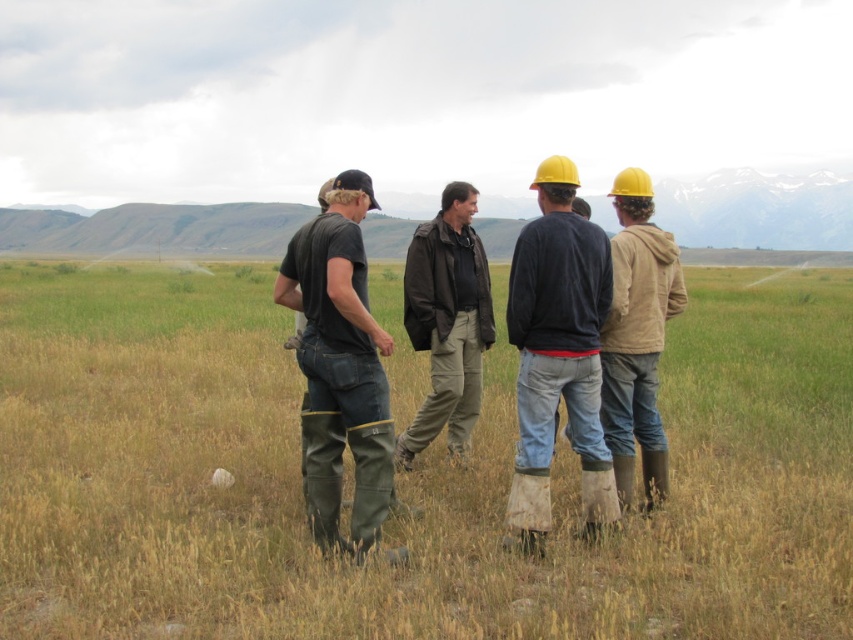
Is point (692, 333) farther from camera compared to point (428, 241)?

Yes, it is.

Between point (196, 435) and point (459, 269), which one is positioned behind?

Point (196, 435)

Locate an element on the screen. The height and width of the screenshot is (640, 853). green grassy at center is located at coordinates (405, 476).

Is the position of tan fabric jacket at right less distant than that of dark brown leather jacket at center?

Yes, tan fabric jacket at right is in front of dark brown leather jacket at center.

Between point (666, 257) and point (469, 346), which one is positioned behind?

The point (469, 346) is behind.

Image resolution: width=853 pixels, height=640 pixels. I want to click on tan fabric jacket at right, so click(x=637, y=337).

Which of these two, dark green rubber boots at center or tan fabric jacket at right, stands taller?

Standing taller between the two is dark green rubber boots at center.

Is dark green rubber boots at center to the right of tan fabric jacket at right from the viewer's perspective?

Incorrect, dark green rubber boots at center is not on the right side of tan fabric jacket at right.

Where is `dark green rubber boots at center`? Image resolution: width=853 pixels, height=640 pixels. dark green rubber boots at center is located at coordinates (340, 369).